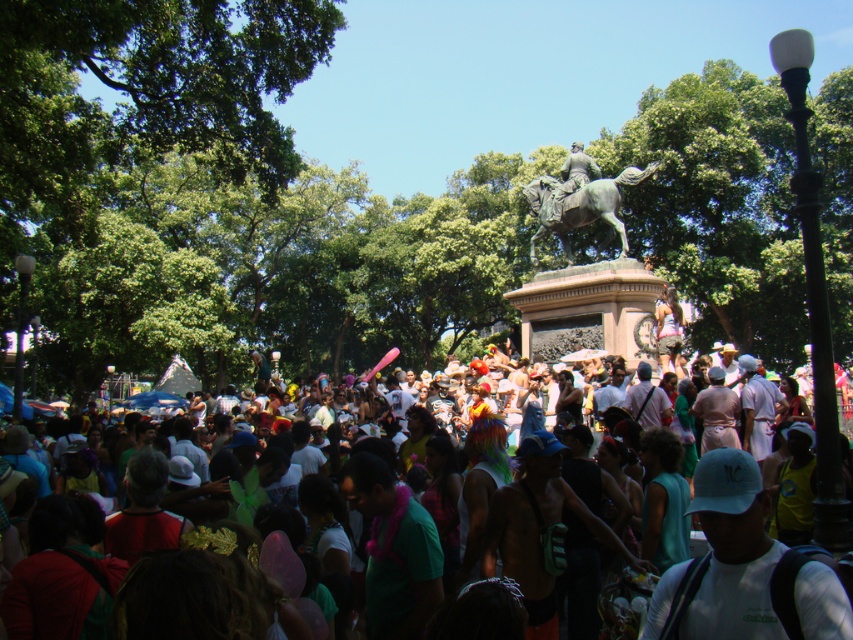
Question: Which point is farther to the camera?

Choices:
 (A) (764, 538)
 (B) (596, 182)

Answer: (B)

Question: Does multicolored costumes at center appear on the right side of bronze statue at upper center?

Choices:
 (A) no
 (B) yes

Answer: (A)

Question: In this image, where is multicolored costumes at center located relative to bronze polished horse at center?

Choices:
 (A) left
 (B) right

Answer: (A)

Question: Which object is positioned farthest from the bronze polished horse at center?

Choices:
 (A) bronze statue at upper center
 (B) multicolored costumes at center

Answer: (B)

Question: Is multicolored costumes at center thinner than bronze statue at upper center?

Choices:
 (A) yes
 (B) no

Answer: (B)

Question: Which point is farther from the camera taking this photo?

Choices:
 (A) (587, 182)
 (B) (704, 499)
 (C) (573, 225)

Answer: (A)